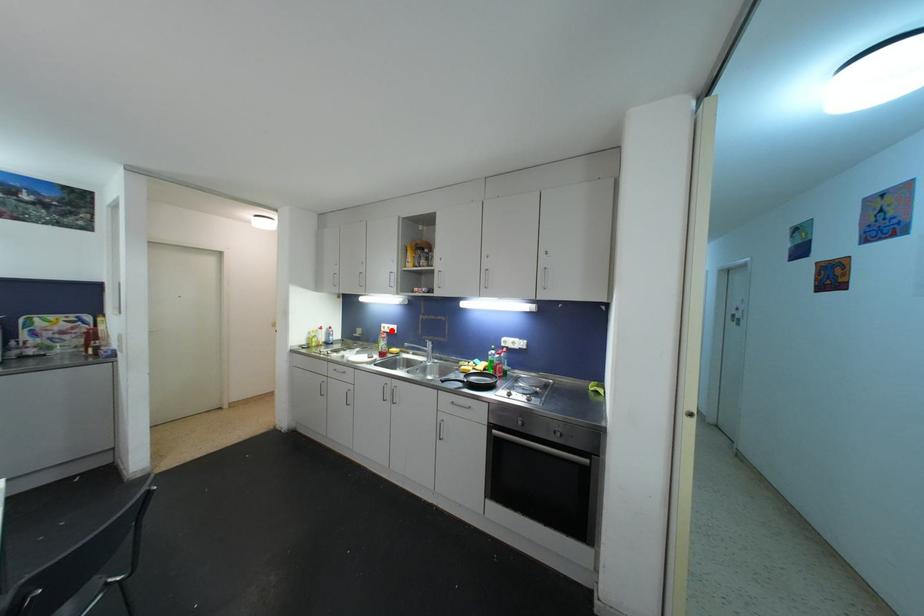
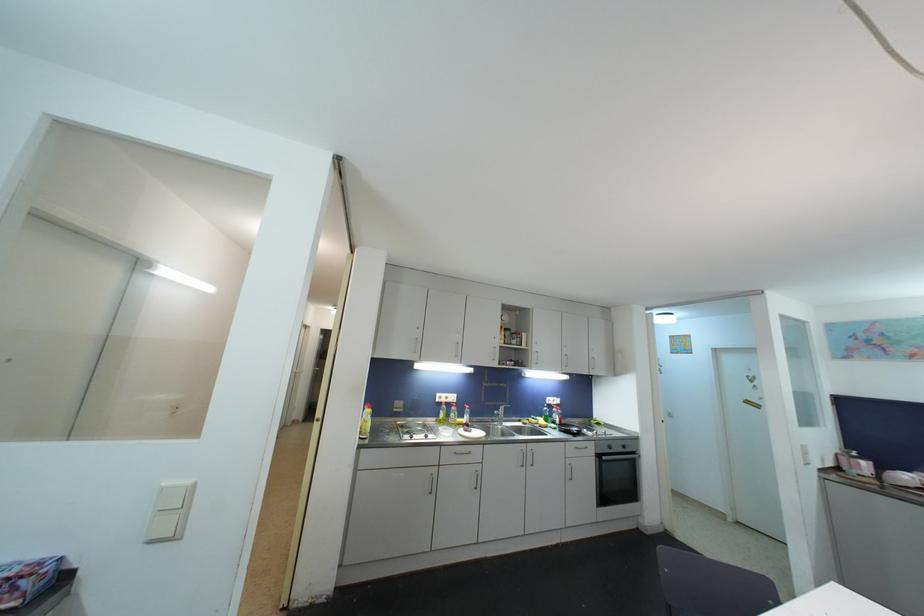
Question: I am providing you with two images of the same scene from different viewpoints. A red point is shown in image1. For the corresponding object point in image2, is it positioned nearer or farther from the camera?

Choices:
 (A) Nearer
 (B) Farther

Answer: (B)